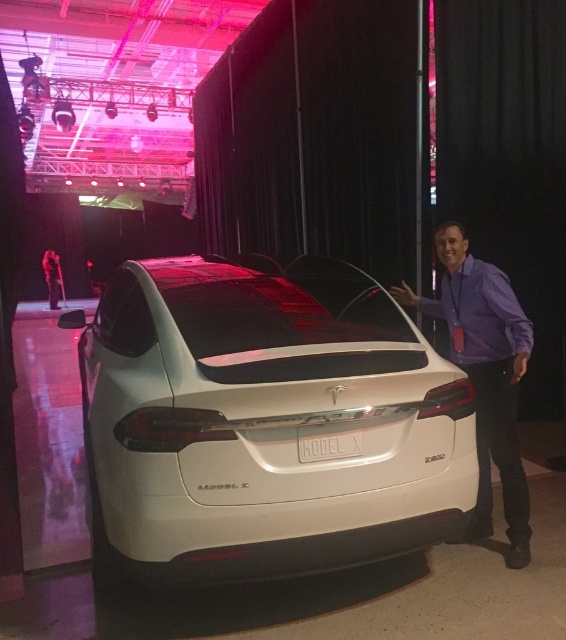
Question: Which point is farther to the camera?

Choices:
 (A) (490, 502)
 (B) (388, 390)

Answer: (A)

Question: Is white glossy car at center wider than purple shirt at right?

Choices:
 (A) yes
 (B) no

Answer: (A)

Question: Observing the image, what is the correct spatial positioning of white glossy car at center in reference to purple shirt at right?

Choices:
 (A) below
 (B) above

Answer: (B)

Question: Is white glossy car at center above purple shirt at right?

Choices:
 (A) yes
 (B) no

Answer: (A)

Question: Which point appears farthest from the camera in this image?

Choices:
 (A) (379, 484)
 (B) (486, 531)

Answer: (B)